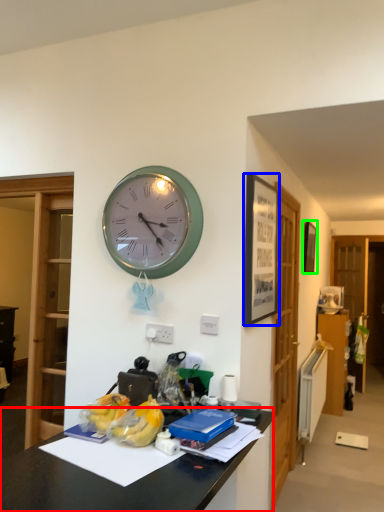
Question: Estimate the real-world distances between objects in this image. Which object is closer to desk (highlighted by a red box), picture frame (highlighted by a blue box) or picture frame (highlighted by a green box)?

Choices:
 (A) picture frame
 (B) picture frame

Answer: (A)